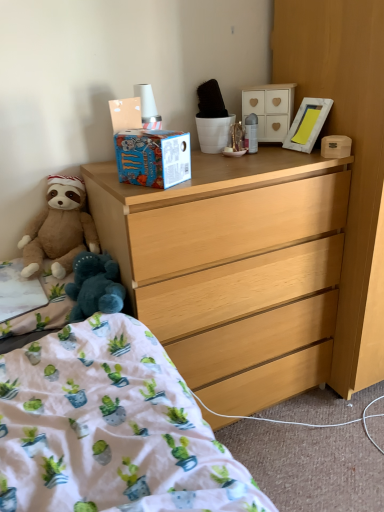
Find the location of a particular element. The height and width of the screenshot is (512, 384). cotton-blend blanket at lower left, which appears as the second sheet when ordered from the bottom is located at coordinates (43, 307).

Locate an element on the screen. This screenshot has height=512, width=384. light wood dresser at center is located at coordinates (234, 268).

Identify the location of white wooden picture frame at upper right. The width and height of the screenshot is (384, 512). (307, 124).

I want to click on cotton-blend blanket at lower left, acting as the 1th sheet starting from the top, so click(x=43, y=307).

Is white fabric at lower left, the 1th sheet from the bottom, positioned before white wooden picture frame at upper right?

That is True.

Is white fabric at lower left, marked as the second sheet in a top-to-bottom arrangement, facing away from white wooden picture frame at upper right?

No, white fabric at lower left, marked as the second sheet in a top-to-bottom arrangement, is not facing the opposite direction of white wooden picture frame at upper right.

Does white fabric at lower left, marked as the second sheet in a top-to-bottom arrangement, contain white wooden picture frame at upper right?

That's incorrect, white wooden picture frame at upper right is not inside white fabric at lower left, marked as the second sheet in a top-to-bottom arrangement.

Does white fabric at lower left, the 1th sheet from the bottom, have a lesser height compared to white wooden picture frame at upper right?

Correct, white fabric at lower left, the 1th sheet from the bottom, is not as tall as white wooden picture frame at upper right.

Who is bigger, brown plush teddy bear at left or white wooden picture frame at upper right?

Bigger between the two is brown plush teddy bear at left.

Does point (50, 176) come closer to viewer compared to point (304, 123)?

Yes, it is in front of point (304, 123).

Which of these two, brown plush teddy bear at left or white wooden picture frame at upper right, is thinner?

white wooden picture frame at upper right is thinner.

Is brown plush teddy bear at left outside of white wooden picture frame at upper right?

Yes.

Image resolution: width=384 pixels, height=512 pixels. What are the coordinates of `picture frame above the cotton-blend blanket at lower left, acting as the 1th sheet starting from the top (from a real-world perspective)` in the screenshot? It's located at (307, 124).

Is there a large distance between white wooden picture frame at upper right and cotton-blend blanket at lower left, acting as the 1th sheet starting from the top?

They are positioned close to each other.

How much distance is there between white wooden picture frame at upper right and cotton-blend blanket at lower left, which appears as the second sheet when ordered from the bottom?

white wooden picture frame at upper right is 38.83 inches away from cotton-blend blanket at lower left, which appears as the second sheet when ordered from the bottom.

From the image's perspective, is white wooden picture frame at upper right under cotton-blend blanket at lower left, which appears as the second sheet when ordered from the bottom?

Actually, white wooden picture frame at upper right appears above cotton-blend blanket at lower left, which appears as the second sheet when ordered from the bottom, in the image.

Measure the distance between white matte cabinet at upper center, positioned as the 2th cabinetry in right-to-left order, and light wood dresser at center, which appears as the second cabinetry when viewed from the left.

11.37 inches.

This screenshot has height=512, width=384. Identify the location of cabinetry that appears on the left of light wood dresser at center, acting as the 2th cabinetry starting from the top. (270, 109).

Is white matte cabinet at upper center, the second cabinetry ordered from the bottom, facing towards light wood dresser at center, the first cabinetry positioned from the right?

No.

Considering the relative sizes of white matte cabinet at upper center, placed as the first cabinetry when sorted from top to bottom, and light wood dresser at center, which appears as the second cabinetry when viewed from the left, in the image provided, is white matte cabinet at upper center, placed as the first cabinetry when sorted from top to bottom, shorter than light wood dresser at center, which appears as the second cabinetry when viewed from the left,?

Indeed, white matte cabinet at upper center, placed as the first cabinetry when sorted from top to bottom, has a lesser height compared to light wood dresser at center, which appears as the second cabinetry when viewed from the left.

Looking at this image, from the image's perspective, between brown plush teddy bear at left and white cotton bed at lower left, who is located below?

white cotton bed at lower left appears lower in the image.

Between brown plush teddy bear at left and white cotton bed at lower left, which one has more height?

brown plush teddy bear at left is taller.

Is brown plush teddy bear at left closer to camera compared to white cotton bed at lower left?

No, brown plush teddy bear at left is behind white cotton bed at lower left.

How much distance is there between brown plush teddy bear at left and white cotton bed at lower left?

The distance of brown plush teddy bear at left from white cotton bed at lower left is 52.90 centimeters.

Is brown plush teddy bear at left far from cotton-blend blanket at lower left, acting as the 1th sheet starting from the top?

No, brown plush teddy bear at left is not far away from cotton-blend blanket at lower left, acting as the 1th sheet starting from the top.

Does brown plush teddy bear at left have a lesser width compared to cotton-blend blanket at lower left, acting as the 1th sheet starting from the top?

Yes, brown plush teddy bear at left is thinner than cotton-blend blanket at lower left, acting as the 1th sheet starting from the top.

From a real-world perspective, starting from the brown plush teddy bear at left, which sheet is the 1st one below it? Please provide its 2D coordinates.

[(43, 307)]

From a real-world perspective, is brown plush teddy bear at left physically above cotton-blend blanket at lower left, which appears as the second sheet when ordered from the bottom?

Indeed, from a real-world perspective, brown plush teddy bear at left stands above cotton-blend blanket at lower left, which appears as the second sheet when ordered from the bottom.

Is light wood dresser at center, the first cabinetry in the bottom-to-top sequence, located within white cotton bed at lower left?

That's incorrect, light wood dresser at center, the first cabinetry in the bottom-to-top sequence, is not inside white cotton bed at lower left.

Is point (217, 443) positioned after point (346, 350)?

No, (217, 443) is in front of (346, 350).

How different are the orientations of white cotton bed at lower left and light wood dresser at center, acting as the 2th cabinetry starting from the top, in degrees?

The facing directions of white cotton bed at lower left and light wood dresser at center, acting as the 2th cabinetry starting from the top, are 90.6 degrees apart.

Where is `picture frame positioned vertically above the white fabric at lower left, the 1th sheet from the bottom (from a real-world perspective)`? This screenshot has width=384, height=512. picture frame positioned vertically above the white fabric at lower left, the 1th sheet from the bottom (from a real-world perspective) is located at coordinates (307, 124).

This screenshot has height=512, width=384. In order to click on picture frame that is behind the brown plush teddy bear at left in this screenshot , I will do `click(307, 124)`.

Based on the photo, from the image, which object appears to be farther from white matte cabinet at upper center, placed as the first cabinetry when sorted from top to bottom, light wood dresser at center or white fabric at lower left, marked as the second sheet in a top-to-bottom arrangement?

white fabric at lower left, marked as the second sheet in a top-to-bottom arrangement, is further to white matte cabinet at upper center, placed as the first cabinetry when sorted from top to bottom.

When comparing their distances from light wood dresser at center, the first cabinetry in the bottom-to-top sequence, does brown plush teddy bear at left or white cotton bed at lower left seem closer?

brown plush teddy bear at left lies closer to light wood dresser at center, the first cabinetry in the bottom-to-top sequence, than the other object.

Looking at the image, which one is located closer to cotton-blend blanket at lower left, which appears as the second sheet when ordered from the bottom, white fabric at lower left, the 1th sheet from the bottom, or brown plush teddy bear at left?

The object closer to cotton-blend blanket at lower left, which appears as the second sheet when ordered from the bottom, is white fabric at lower left, the 1th sheet from the bottom.

From the image, which object appears to be farther from white wooden picture frame at upper right, light wood dresser at center or light wood dresser at center, the first cabinetry positioned from the right?

Based on the image, light wood dresser at center appears to be further to white wooden picture frame at upper right.

Considering their positions, is white matte cabinet at upper center, positioned as the 2th cabinetry in right-to-left order, positioned further to white cotton bed at lower left than white wooden picture frame at upper right?

white matte cabinet at upper center, positioned as the 2th cabinetry in right-to-left order.

Looking at the image, which one is located closer to white fabric at lower left, the 1th sheet from the bottom, brown plush teddy bear at left or white matte cabinet at upper center, positioned as the 2th cabinetry in right-to-left order?

brown plush teddy bear at left.

Which object lies nearer to the anchor point light wood dresser at center, the first cabinetry positioned from the right, cotton-blend blanket at lower left, acting as the 1th sheet starting from the top, or white fabric at lower left, marked as the second sheet in a top-to-bottom arrangement?

Based on the image, cotton-blend blanket at lower left, acting as the 1th sheet starting from the top, appears to be nearer to light wood dresser at center, the first cabinetry positioned from the right.

Estimate the real-world distances between objects in this image. Which object is further from light wood dresser at center, acting as the 2th cabinetry starting from the top, cotton-blend blanket at lower left, acting as the 1th sheet starting from the top, or white cotton bed at lower left?

cotton-blend blanket at lower left, acting as the 1th sheet starting from the top, is positioned further to the anchor light wood dresser at center, acting as the 2th cabinetry starting from the top.

You are a GUI agent. You are given a task and a screenshot of the screen. Output one action in this format:
    pyautogui.click(x=<x>, y=<y>)
    Task: Click on the sheet situated between white fabric at lower left, marked as the second sheet in a top-to-bottom arrangement, and white cotton bed at lower left from left to right
    This screenshot has width=384, height=512.
    Given the screenshot: What is the action you would take?
    pyautogui.click(x=43, y=307)

Where is `teddy bear between white fabric at lower left, marked as the second sheet in a top-to-bottom arrangement, and white matte cabinet at upper center, marked as the first cabinetry in a left-to-right arrangement`? This screenshot has height=512, width=384. teddy bear between white fabric at lower left, marked as the second sheet in a top-to-bottom arrangement, and white matte cabinet at upper center, marked as the first cabinetry in a left-to-right arrangement is located at coordinates (59, 229).

This screenshot has width=384, height=512. I want to click on cabinetry between cotton-blend blanket at lower left, acting as the 1th sheet starting from the top, and white wooden picture frame at upper right, in the horizontal direction, so click(270, 109).

At what (x,y) coordinates should I click in order to perform the action: click on cabinetry situated between brown plush teddy bear at left and white wooden picture frame at upper right from left to right. Please return your answer as a coordinate pair (x, y). Looking at the image, I should click on (270, 109).